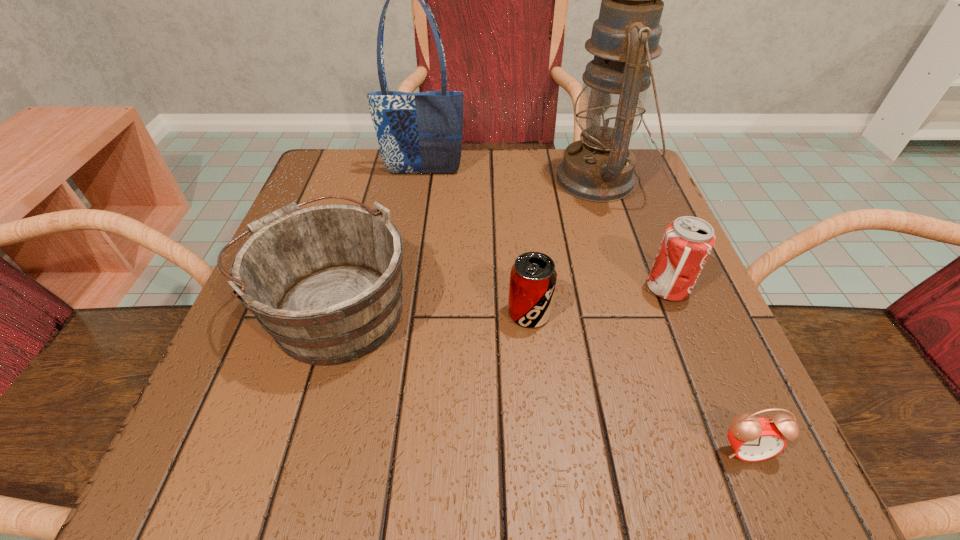
The image size is (960, 540). Find the location of `alarm clock that is at the right edge`. alarm clock that is at the right edge is located at coordinates (752, 439).

Identify the location of object present at the far left corner. (418, 133).

This screenshot has width=960, height=540. I want to click on object that is at the far right corner, so click(600, 168).

Find the location of a particular element. The image size is (960, 540). object that is at the near right corner is located at coordinates (752, 439).

Where is `vacant area at the far edge`? The image size is (960, 540). vacant area at the far edge is located at coordinates (418, 199).

Identify the location of blank space at the right edge. (681, 380).

Find the location of a particular element. vacant area at the far left corner of the desktop is located at coordinates (341, 184).

I want to click on free space at the near left corner of the desktop, so click(x=252, y=457).

I want to click on vacant area at the far right corner, so click(647, 188).

This screenshot has width=960, height=540. Identify the location of free space at the near right corner. (710, 475).